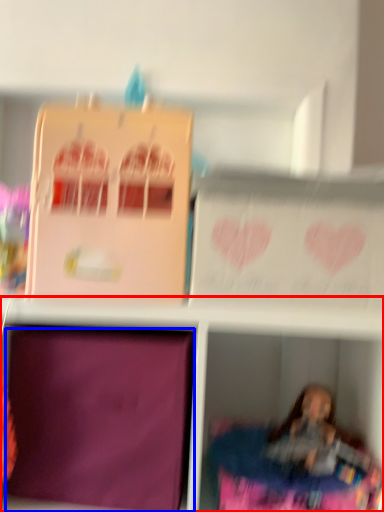
Question: Among these objects, which one is nearest to the camera, shelf (highlighted by a red box) or cardboard box (highlighted by a blue box)?

Choices:
 (A) shelf
 (B) cardboard box

Answer: (A)